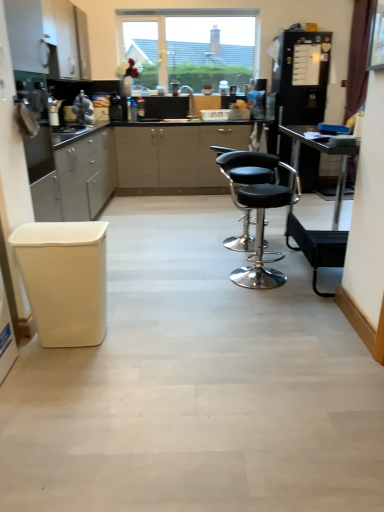
Question: Should I look upward or downward to see black leather bar stool at right, marked as the 2th bar stool in a left-to-right arrangement?

Choices:
 (A) down
 (B) up

Answer: (B)

Question: Is black matte refrigerator at right, which ranks as the fourth appliance in left-to-right order, oriented towards metallic stainless steel oven at left, the 1th appliance when ordered from front to back?

Choices:
 (A) no
 (B) yes

Answer: (A)

Question: Does black matte refrigerator at right, the 2th appliance viewed from the back, lie behind metallic stainless steel oven at left, the 4th appliance viewed from the back?

Choices:
 (A) no
 (B) yes

Answer: (B)

Question: From the image's perspective, is black matte refrigerator at right, the 1th appliance from the right, beneath metallic stainless steel oven at left, the 4th appliance viewed from the back?

Choices:
 (A) no
 (B) yes

Answer: (A)

Question: Can you confirm if black matte refrigerator at right, the 2th appliance viewed from the back, is taller than metallic stainless steel oven at left, the 4th appliance viewed from the back?

Choices:
 (A) no
 (B) yes

Answer: (B)

Question: Can you confirm if black matte refrigerator at right, the 3th appliance in the front-to-back sequence, is positioned to the right of metallic stainless steel oven at left, the 4th appliance viewed from the back?

Choices:
 (A) yes
 (B) no

Answer: (A)

Question: Is black matte refrigerator at right, which ranks as the fourth appliance in left-to-right order, thinner than metallic stainless steel oven at left, the 1th appliance when ordered from front to back?

Choices:
 (A) yes
 (B) no

Answer: (B)

Question: Does black matte refrigerator at right, which ranks as the fourth appliance in left-to-right order, come in front of black leather bar stool at right, placed as the first bar stool when sorted from right to left?

Choices:
 (A) no
 (B) yes

Answer: (A)

Question: Can you confirm if black matte refrigerator at right, the 3th appliance in the front-to-back sequence, is positioned to the right of black leather bar stool at right, positioned as the 1th bar stool in back-to-front order?

Choices:
 (A) yes
 (B) no

Answer: (A)

Question: Is black matte refrigerator at right, which ranks as the fourth appliance in left-to-right order, further to camera compared to black leather bar stool at right, positioned as the 1th bar stool in back-to-front order?

Choices:
 (A) no
 (B) yes

Answer: (B)

Question: From the image's perspective, would you say black matte refrigerator at right, the 1th appliance from the right, is positioned over black leather bar stool at right, positioned as the 1th bar stool in back-to-front order?

Choices:
 (A) yes
 (B) no

Answer: (A)

Question: Could you tell me if black matte refrigerator at right, the 3th appliance in the front-to-back sequence, is turned towards black leather bar stool at right, placed as the first bar stool when sorted from right to left?

Choices:
 (A) yes
 (B) no

Answer: (A)

Question: Does black matte refrigerator at right, the 1th appliance from the right, have a larger size compared to black leather bar stool at right, placed as the first bar stool when sorted from right to left?

Choices:
 (A) no
 (B) yes

Answer: (B)

Question: Does white matte cabinet at upper left contain black leather stool at center?

Choices:
 (A) no
 (B) yes

Answer: (A)